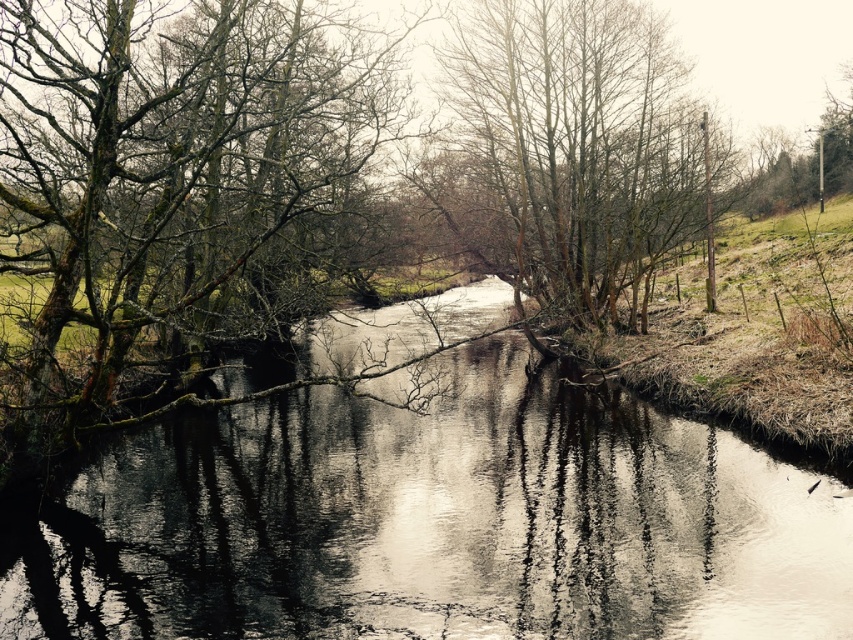
From the picture: You are an arborist examining the river scene. You notice the green mossy branches at left and the bare branches at center. Which of these two branches would be more fragile when subjected to heavy snowfall?

The green mossy branches at left are thinner than the bare branches at center, making them more prone to breaking under the weight of heavy snowfall.

Looking at this image, you are standing at the edge of the river in the scene. There is a point marked at coordinates point [434,524]. Is this point located in the reflective water at center?

Yes, the point [434,524] is located in the reflective water at center as stated in the Objects Description.

You are a bird looking for a sturdy place to perch. You see the green mossy branches at left and the bare branches at center. Which one is bigger and would provide a more stable perch?

The green mossy branches at left are larger in size compared to the bare branches at center, so they would provide a more stable perch.